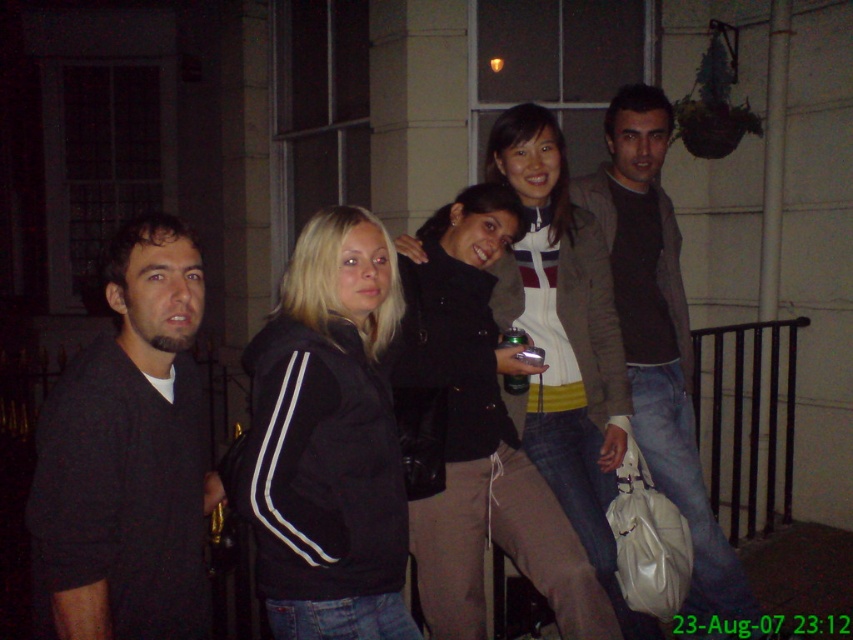
Which is above, dark matte sweater at left or black fabric jacket at center?

black fabric jacket at center is higher up.

Can you confirm if dark matte sweater at left is wider than black fabric jacket at center?

In fact, dark matte sweater at left might be narrower than black fabric jacket at center.

Which is behind, point (152, 372) or point (393, 308)?

Point (393, 308)

This screenshot has height=640, width=853. Find the location of `dark matte sweater at left`. dark matte sweater at left is located at coordinates (128, 458).

Which of these two, dark matte sweater at left or dark brown sweater at center, stands shorter?

Standing shorter between the two is dark matte sweater at left.

Is dark matte sweater at left smaller than dark brown sweater at center?

Indeed, dark matte sweater at left has a smaller size compared to dark brown sweater at center.

Where is `dark matte sweater at left`? dark matte sweater at left is located at coordinates (128, 458).

Image resolution: width=853 pixels, height=640 pixels. What are the coordinates of `dark matte sweater at left` in the screenshot? It's located at (128, 458).

Can you confirm if black leather jacket at center is taller than dark brown sweater at center?

No.

Between black leather jacket at center and dark brown sweater at center, which one has more height?

Standing taller between the two is dark brown sweater at center.

Describe the element at coordinates (563, 365) in the screenshot. I see `black leather jacket at center` at that location.

Image resolution: width=853 pixels, height=640 pixels. What are the coordinates of `black leather jacket at center` in the screenshot? It's located at (563, 365).